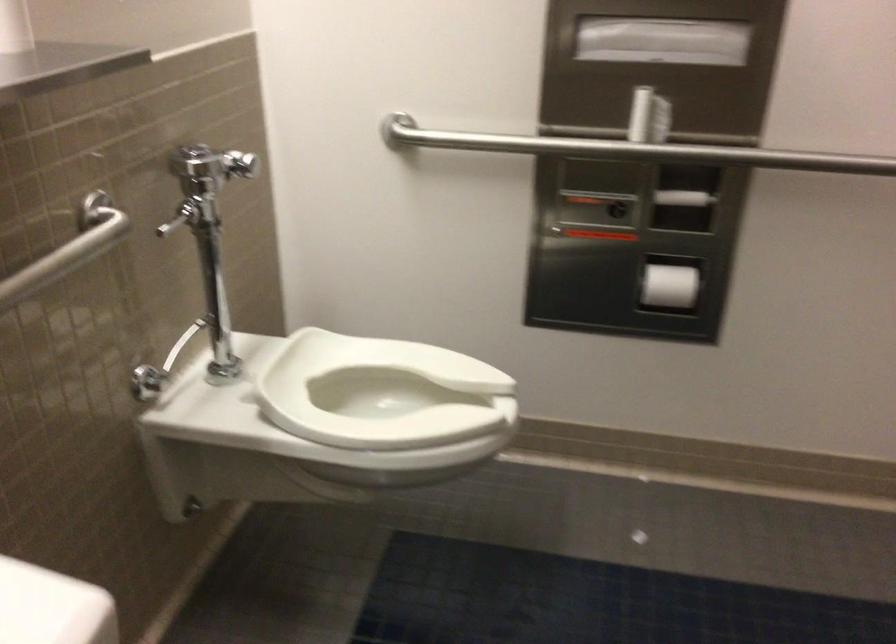
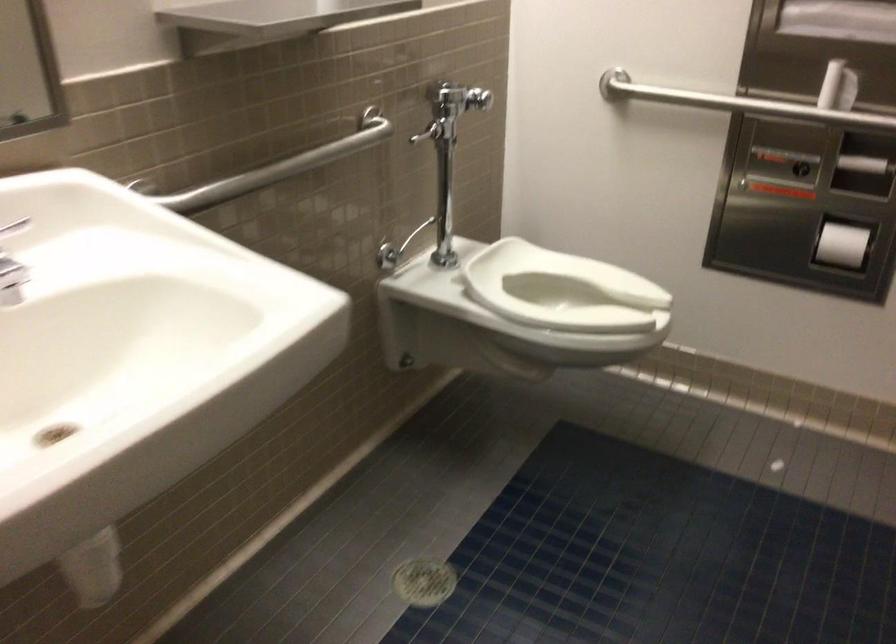
Locate, in the second image, the point that corresponds to (550,149) in the first image.

(739, 104)